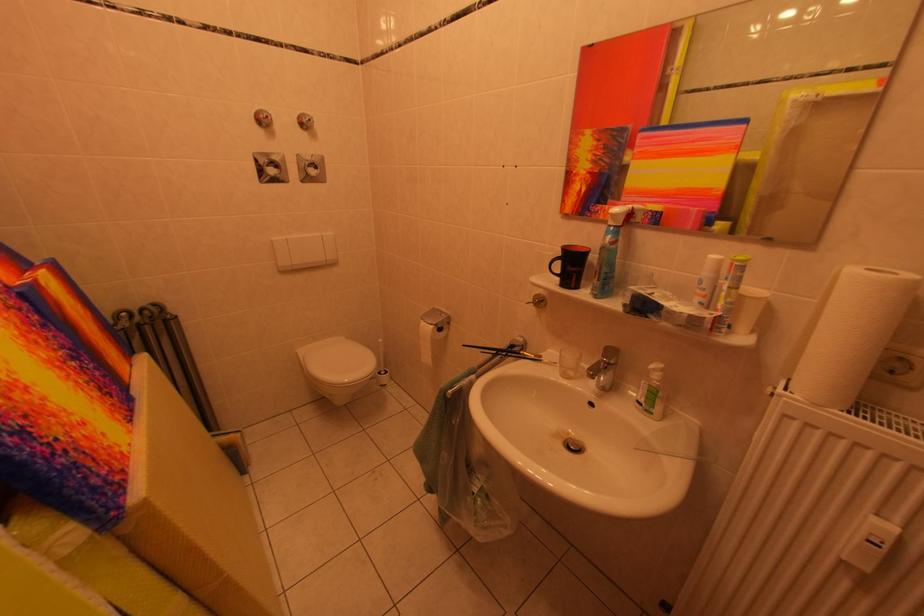
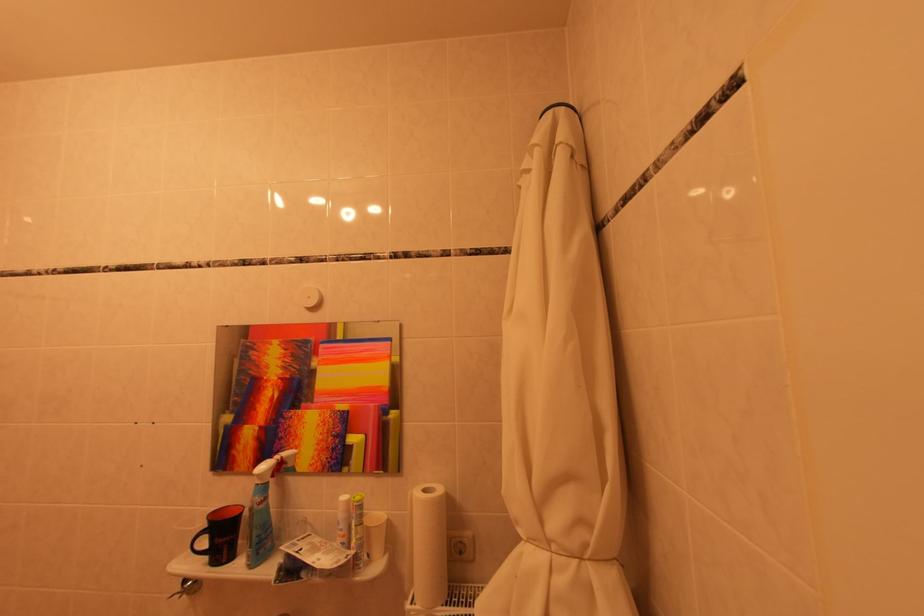
In the second image, find the point that corresponds to point 735,306 in the first image.

(365, 544)